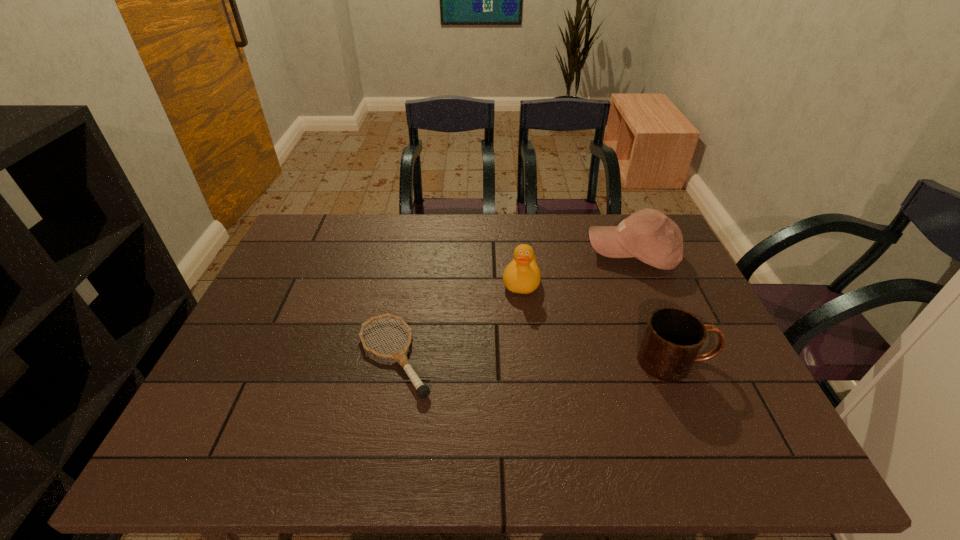
Locate an element on the screen. This screenshot has height=540, width=960. tennis racket is located at coordinates (400, 356).

I want to click on the shortest object, so click(400, 356).

The image size is (960, 540). Identify the location of mug. (673, 337).

Locate an element on the screen. baseball cap is located at coordinates (648, 235).

At what (x,y) coordinates should I click in order to perform the action: click on the second object from left to right. Please return your answer as a coordinate pair (x, y). This screenshot has height=540, width=960. Looking at the image, I should click on (522, 275).

I want to click on blank space located 0.280m on the back of the tennis racket, so click(x=414, y=254).

Find the location of `free spot located on the front-facing side of the baseball cap`. free spot located on the front-facing side of the baseball cap is located at coordinates (555, 307).

Find the location of a particular element. vacant region located 0.190m on the front-facing side of the baseball cap is located at coordinates (565, 298).

Where is `free spot located 0.120m on the front-facing side of the baseball cap`? free spot located 0.120m on the front-facing side of the baseball cap is located at coordinates (581, 287).

Locate an element on the screen. vacant space located 0.090m on the face of the duck is located at coordinates (516, 322).